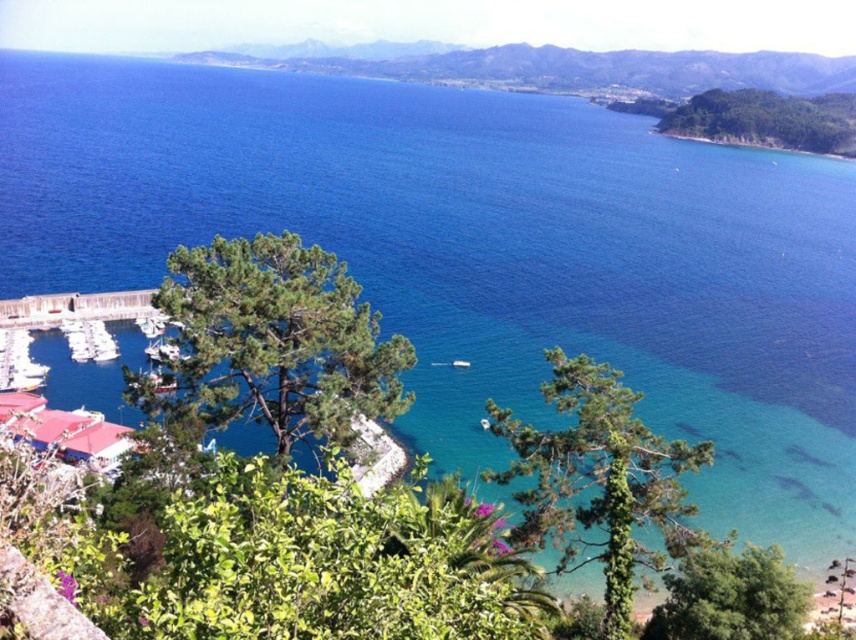
You are standing at the edge of the marina looking out towards the ocean. There is a specific point marked at coordinates point (78, 308). If you want to throw a small buoy to that exact point, and the buoy has a maximum throwing distance of 120 meters, will you be able to reach it?

The point (78, 308) is 129.46 meters away from the viewer. Since the buoy can only be thrown up to 120 meters, you will not be able to reach it.

You are planning to dock your small boat at the brown wooden dock at lower left and the white glossy boat at lower left. Which one can accommodate your boat better based on their sizes?

The brown wooden dock at lower left is larger in size than the white glossy boat at lower left, so it can accommodate your boat better.